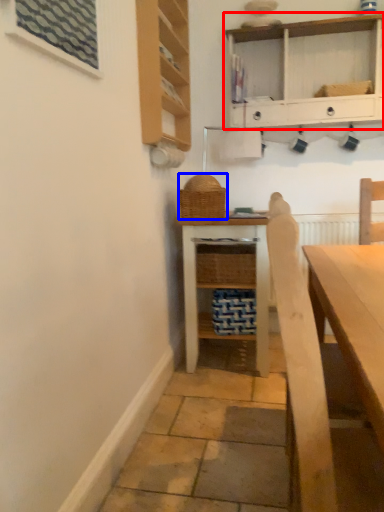
Question: Which object is further to the camera taking this photo, shelf (highlighted by a red box) or basket (highlighted by a blue box)?

Choices:
 (A) shelf
 (B) basket

Answer: (A)